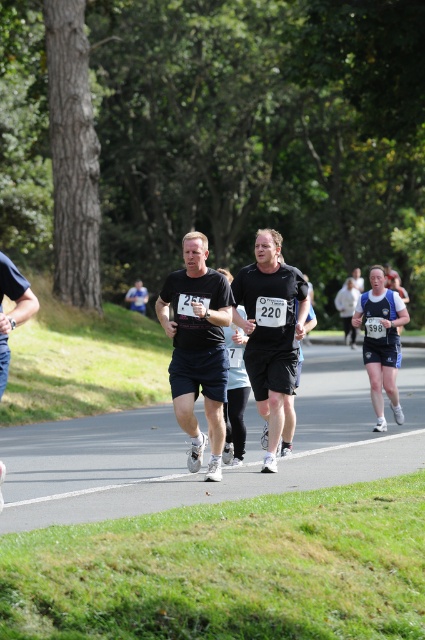
Is black matte t-shirt at center wider than blue fabric shirt at center?

Yes.

Locate an element on the screen. black matte t-shirt at center is located at coordinates (198, 348).

Does black matte t-shirt at center have a larger size compared to black matte shorts at left?

Incorrect, black matte t-shirt at center is not larger than black matte shorts at left.

Is black matte t-shirt at center taller than black matte shorts at left?

No.

Image resolution: width=425 pixels, height=640 pixels. What do you see at coordinates (198, 348) in the screenshot? I see `black matte t-shirt at center` at bounding box center [198, 348].

Locate an element on the screen. The width and height of the screenshot is (425, 640). black matte t-shirt at center is located at coordinates (198, 348).

This screenshot has width=425, height=640. Identify the location of blue fabric shorts at right. (382, 342).

Is point (370, 321) behind point (130, 307)?

No.

Describe the element at coordinates (382, 342) in the screenshot. This screenshot has width=425, height=640. I see `blue fabric shorts at right` at that location.

Locate an element on the screen. The height and width of the screenshot is (640, 425). blue fabric shorts at right is located at coordinates (382, 342).